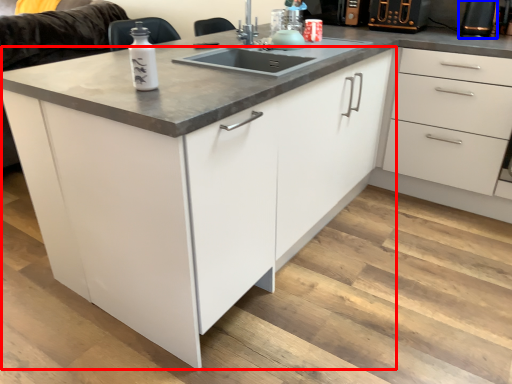
Question: Which of the following is the farthest to the observer, cabinetry (highlighted by a red box) or appliance (highlighted by a blue box)?

Choices:
 (A) cabinetry
 (B) appliance

Answer: (B)